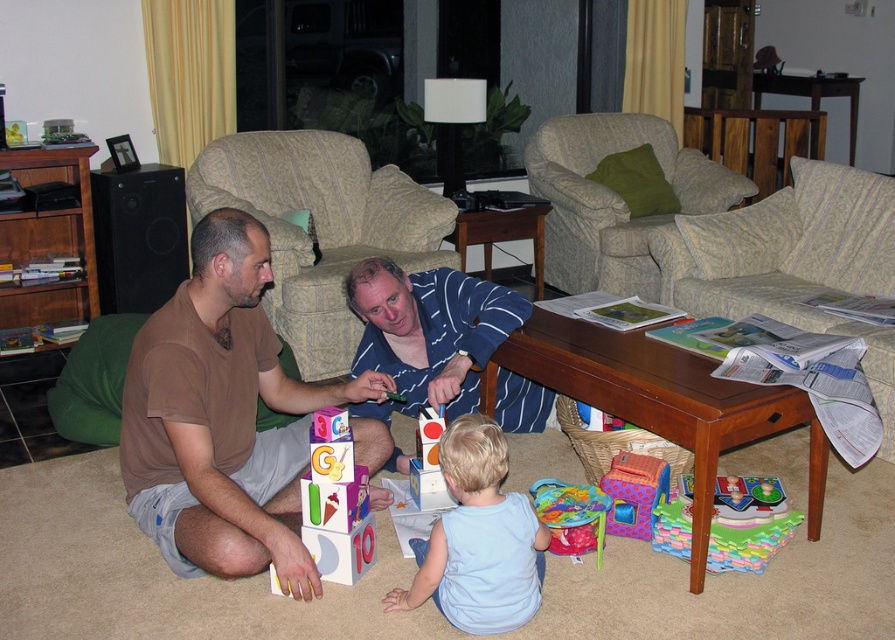
Question: Does beige striped armchair at center lie in front of matte plastic toy at center?

Choices:
 (A) no
 (B) yes

Answer: (A)

Question: Considering the relative positions of light blue cotton shirt at lower center and plastic colorful playhouse at lower center in the image provided, where is light blue cotton shirt at lower center located with respect to plastic colorful playhouse at lower center?

Choices:
 (A) left
 (B) right

Answer: (A)

Question: Is beige striped armchair at center thinner than beige striped armchair at upper center?

Choices:
 (A) yes
 (B) no

Answer: (B)

Question: Which object is the farthest from the blue striped shirt at center?

Choices:
 (A) matte plastic drum at lower center
 (B) light blue cotton shirt at lower center
 (C) matte plastic toy at center

Answer: (B)

Question: Based on their relative distances, which object is nearer to the multicolored foam mat at lower right?

Choices:
 (A) matte plastic blocks at center
 (B) matte plastic toy at center
 (C) light blue cotton shirt at lower center

Answer: (C)

Question: Which point appears closest to the camera in this image?

Choices:
 (A) (445, 362)
 (B) (529, 540)
 (C) (608, 506)
 (D) (749, 540)

Answer: (B)